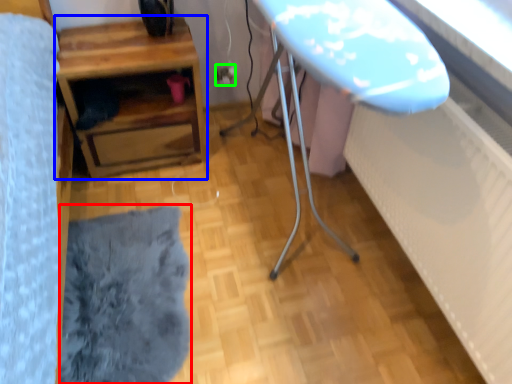
Question: Which object is the farthest from flat (highlighted by a red box)? Choose among these: table (highlighted by a blue box) or electric outlet (highlighted by a green box).

Choices:
 (A) table
 (B) electric outlet

Answer: (B)